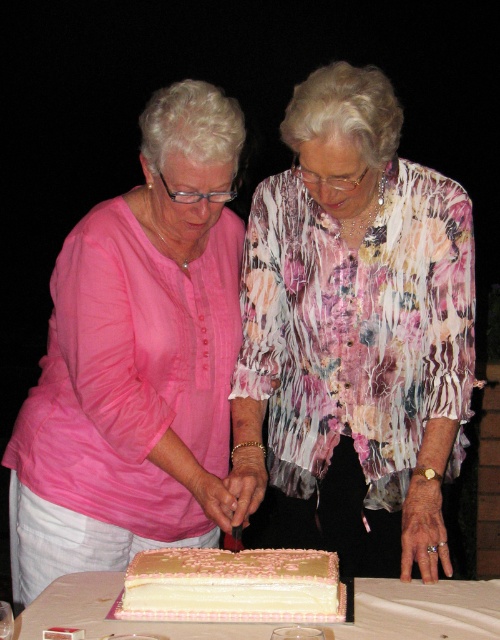
Based on the photo, you are a guest at this event and want to take a photo of the white glossy cake at center without the pink fabric shirt at left blocking it. How should you adjust your position?

Move to the side so that the white glossy cake at center is no longer blocked by the pink fabric shirt at left. Since the cake is behind the shirt, moving to the side will allow you to see the cake without obstruction.

You are at a birthday party and see two cakes at the center of the table. The white glossy cake at center and the white cream cake at center. Which one has a greater width?

The white glossy cake at center has a greater width than the white cream cake at center.